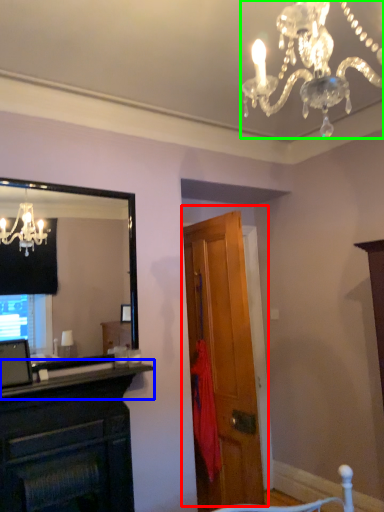
Question: Which object is positioned closest to door (highlighted by a red box)? Select from mantle (highlighted by a blue box) and lamp (highlighted by a green box).

Choices:
 (A) mantle
 (B) lamp

Answer: (A)